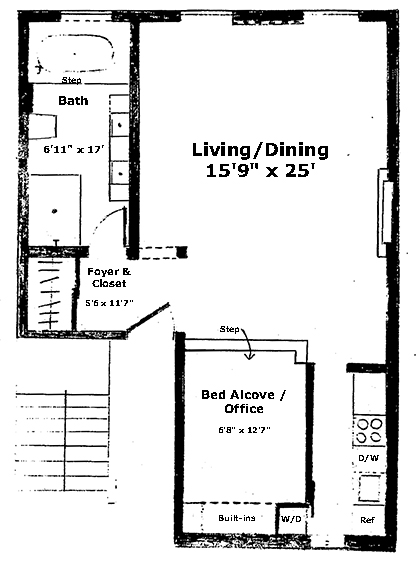
Where is `oven`? oven is located at coordinates (366, 423).